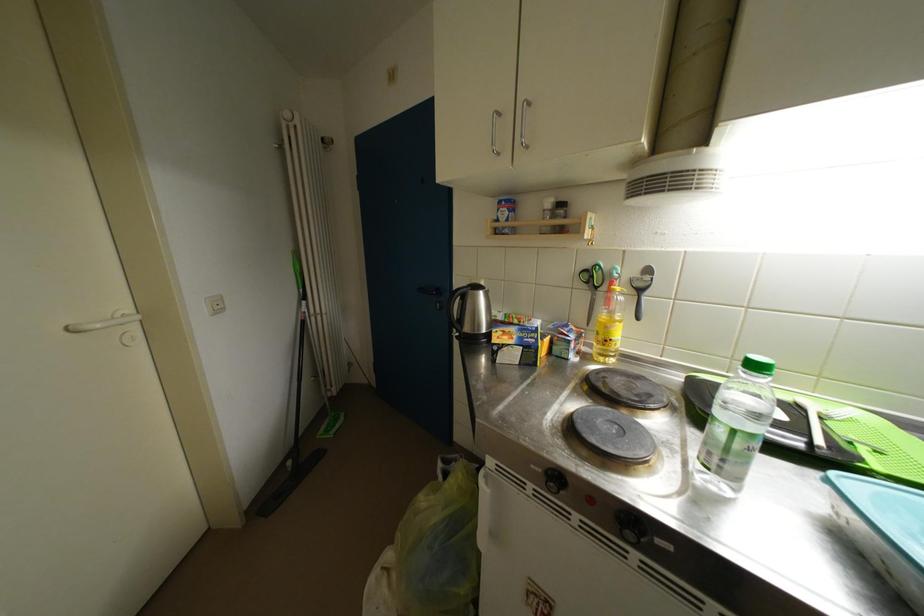
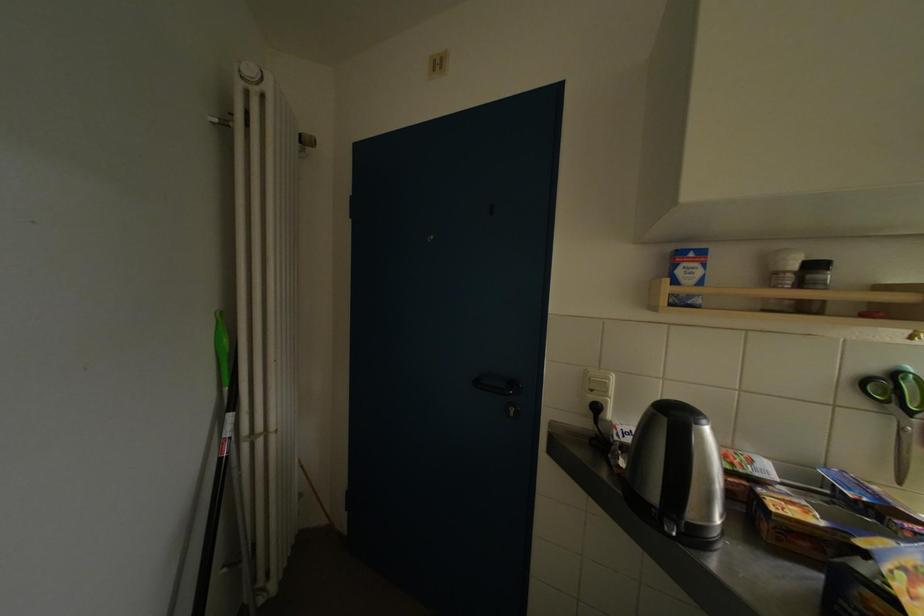
Where in the second image is the point corresponding to [294,119] from the first image?

(256, 75)